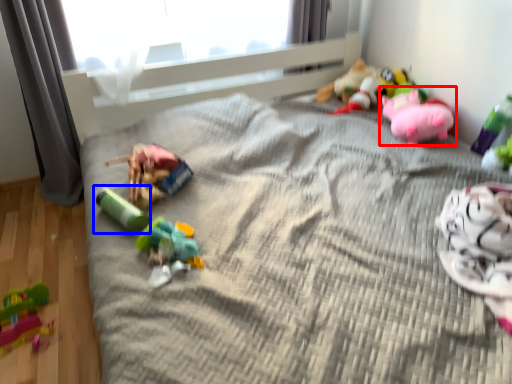
Question: Which point is closer to the camera, toy (highlighted by a red box) or toy (highlighted by a blue box)?

Choices:
 (A) toy
 (B) toy

Answer: (B)